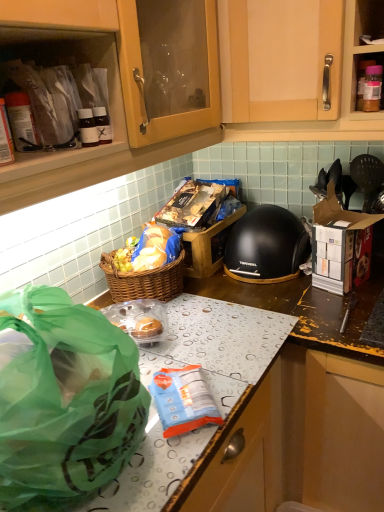
Question: Relative to green translucent bag at lower left, is matte plastic containers at upper left in front or behind?

Choices:
 (A) behind
 (B) front

Answer: (A)

Question: Based on their positions, is matte plastic containers at upper left located to the left or right of green translucent bag at lower left?

Choices:
 (A) right
 (B) left

Answer: (B)

Question: Which object is the farthest from the matte plastic containers at upper left?

Choices:
 (A) cardboard box at right
 (B) green translucent bag at lower left
 (C) blue plastic bag at center
 (D) black matte helmet at center

Answer: (A)

Question: Which object is the closest to the blue plastic bag at center?

Choices:
 (A) black matte helmet at center
 (B) cardboard box at right
 (C) matte plastic containers at upper left
 (D) green translucent bag at lower left

Answer: (D)